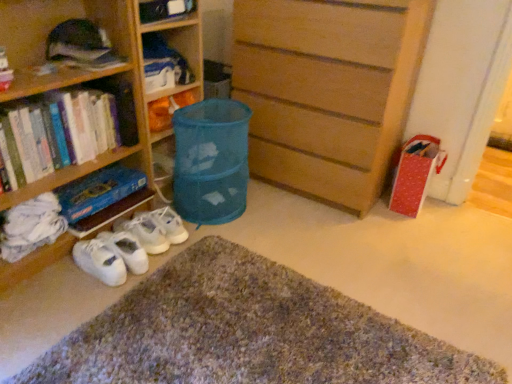
Locate an element on the screen. This screenshot has height=384, width=512. spots to the right of white fabric sneakers at lower left is located at coordinates (170, 272).